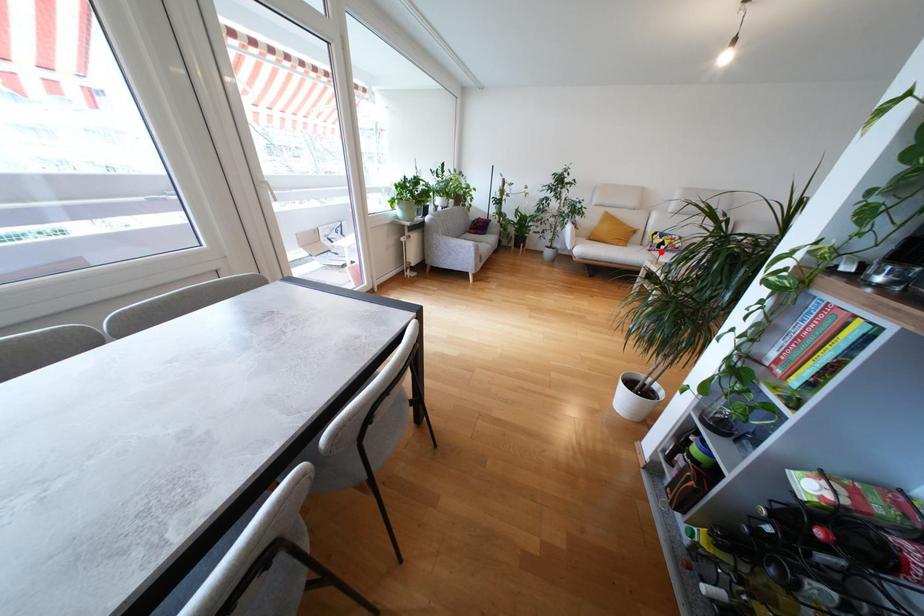
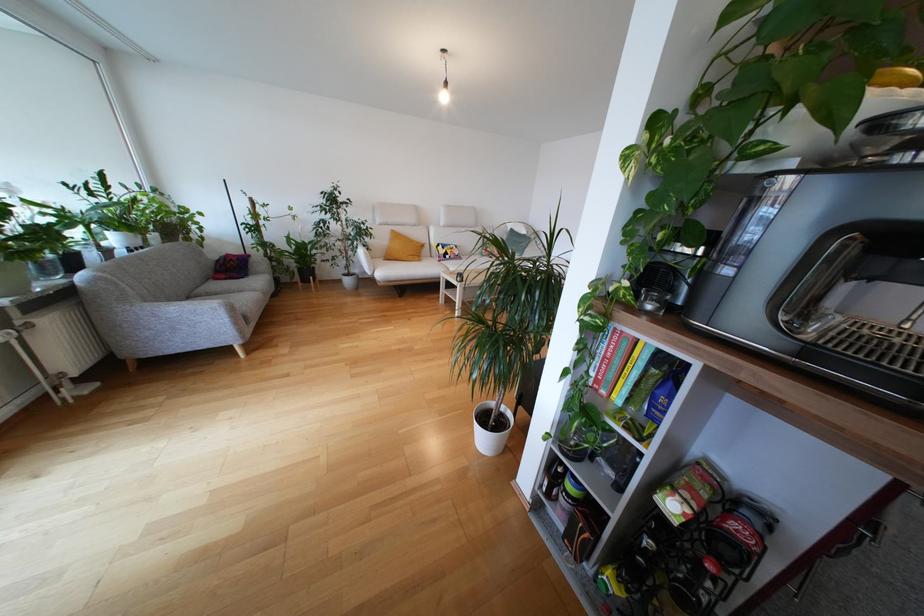
Find the pixel in the second image that matches the highlighted location in the first image.

(448, 262)